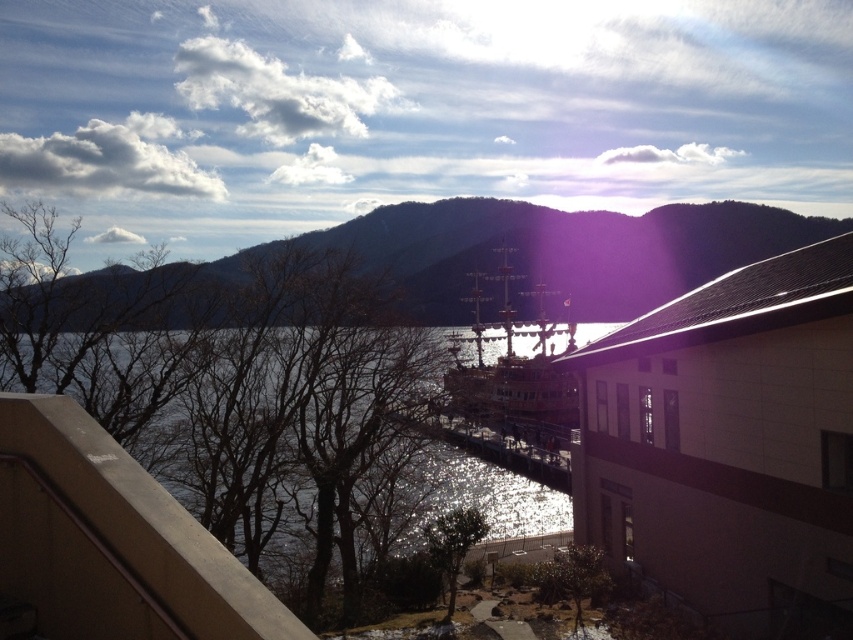
Question: Which point appears farthest from the camera in this image?

Choices:
 (A) (554, 301)
 (B) (485, 467)

Answer: (A)

Question: Can you confirm if brown/mountainous at upper center is thinner than clear water at lower left?

Choices:
 (A) yes
 (B) no

Answer: (B)

Question: Is brown/mountainous at upper center above clear water at lower left?

Choices:
 (A) no
 (B) yes

Answer: (B)

Question: Is brown/mountainous at upper center bigger than clear water at lower left?

Choices:
 (A) no
 (B) yes

Answer: (B)

Question: Which point is farther to the camera?

Choices:
 (A) (471, 225)
 (B) (523, 508)

Answer: (A)

Question: Among these points, which one is nearest to the camera?

Choices:
 (A) (654, 246)
 (B) (430, 474)

Answer: (B)